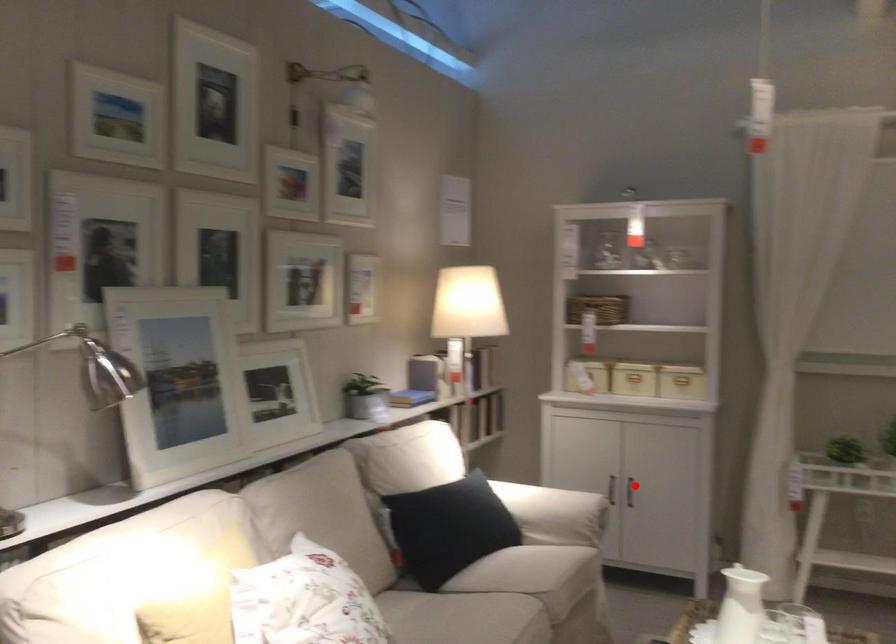
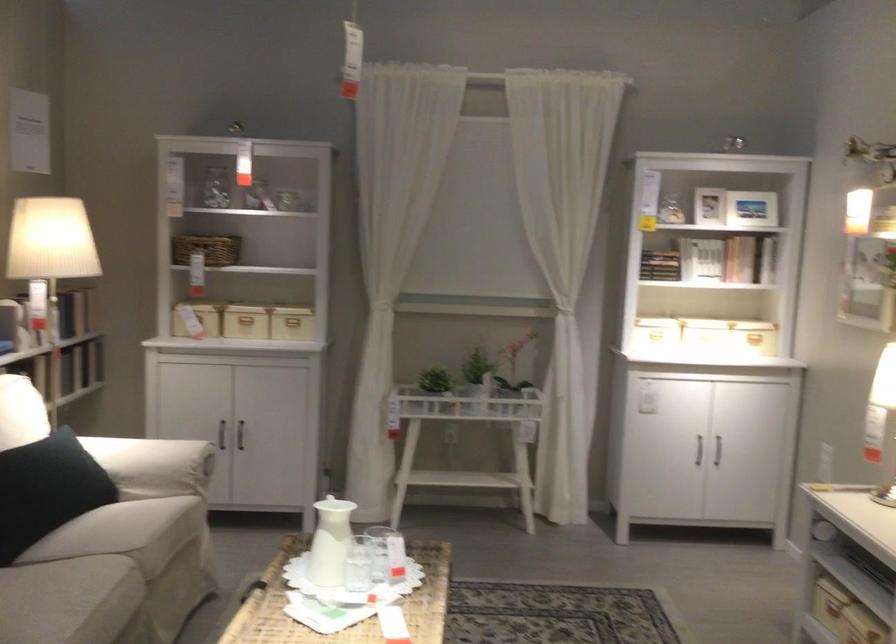
Where in the second image is the point corresponding to the highlighted location from the first image?

(240, 435)